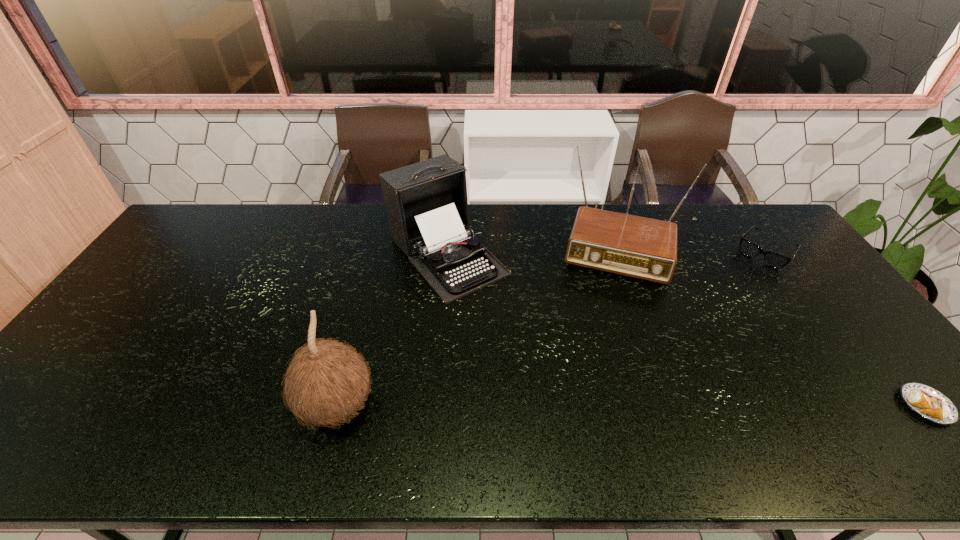
This screenshot has height=540, width=960. I want to click on vacant space at the far edge of the desktop, so click(696, 224).

Locate an element on the screen. free point at the near edge is located at coordinates (198, 414).

Image resolution: width=960 pixels, height=540 pixels. Find the location of `vacant space at the left edge`. vacant space at the left edge is located at coordinates (192, 268).

The image size is (960, 540). In order to click on blank space at the right edge of the desktop in this screenshot , I will do `click(882, 366)`.

In order to click on vacant region at the near left corner of the desktop in this screenshot , I will do `click(81, 399)`.

This screenshot has width=960, height=540. I want to click on vacant area between the second shortest object and the third object from right to left, so click(690, 246).

What are the coordinates of `vacant space that's between the coconut and the typewriter` in the screenshot? It's located at (392, 330).

Where is `free area in between the coconut and the third object from right to left`? Image resolution: width=960 pixels, height=540 pixels. free area in between the coconut and the third object from right to left is located at coordinates (476, 323).

What are the coordinates of `free spot between the third object from left to right and the sunglasses` in the screenshot? It's located at (690, 246).

You are a GUI agent. You are given a task and a screenshot of the screen. Output one action in this format:
    pyautogui.click(x=<x>, y=<y>)
    Task: Click on the vacant space in between the coconut and the second shortest object
    This screenshot has width=960, height=540.
    Given the screenshot: What is the action you would take?
    pyautogui.click(x=551, y=329)